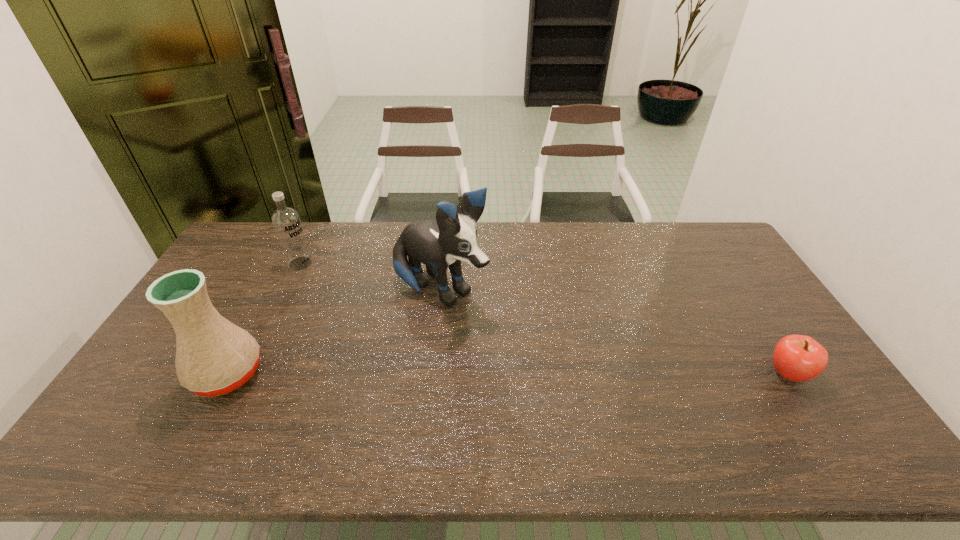
The image size is (960, 540). What are the coordinates of `vacant region located on the front-facing side of the tallest object` in the screenshot? It's located at (575, 379).

Locate an element on the screen. Image resolution: width=960 pixels, height=540 pixels. blank space located on the front label of the vodka is located at coordinates (354, 302).

In order to click on vacant space located 0.370m on the front label of the vodka in this screenshot , I will do `click(376, 319)`.

Where is `free space located on the front label of the vodka`? free space located on the front label of the vodka is located at coordinates (364, 310).

The height and width of the screenshot is (540, 960). Identify the location of object present at the far edge. (286, 221).

Find the location of `pottery present at the near edge`. pottery present at the near edge is located at coordinates click(x=214, y=356).

Where is `apple at the near edge`? apple at the near edge is located at coordinates (798, 358).

Locate an element on the screen. Image resolution: width=960 pixels, height=540 pixels. object present at the left edge is located at coordinates (214, 356).

I want to click on object located in the right edge section of the desktop, so click(798, 358).

You are a GUI agent. You are given a task and a screenshot of the screen. Output one action in this format:
    pyautogui.click(x=<x>, y=<y>)
    Task: Click on the object that is positioned at the near left corner
    
    Given the screenshot: What is the action you would take?
    pyautogui.click(x=214, y=356)